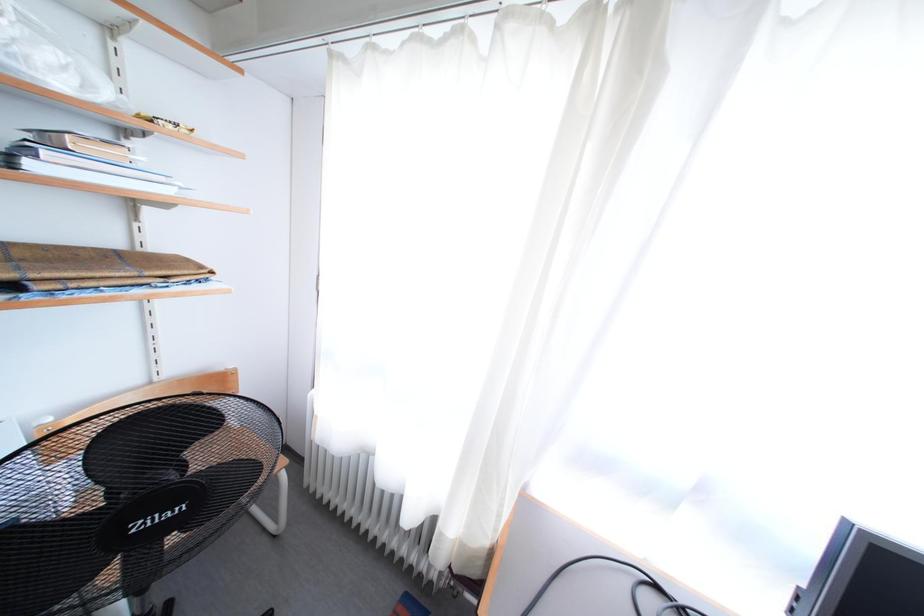
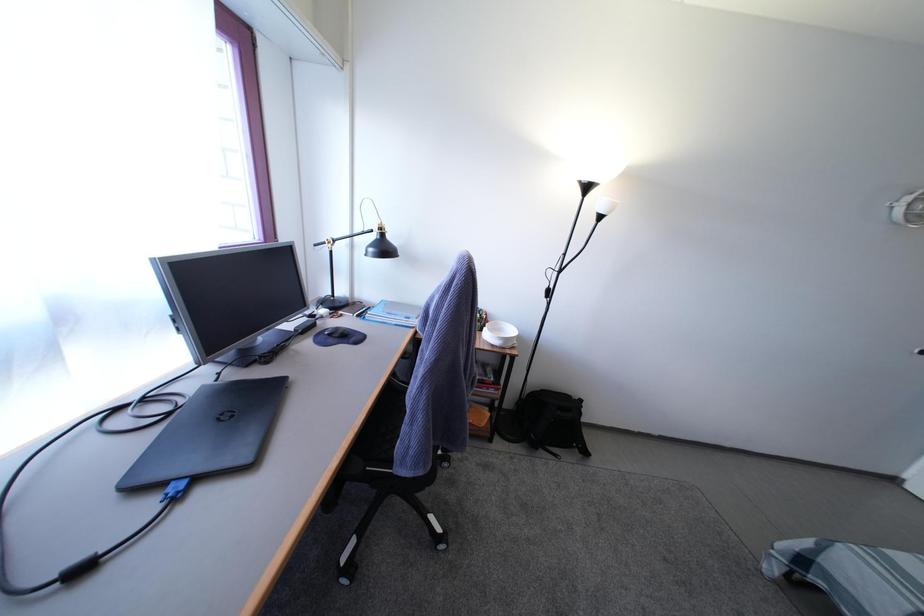
Based on the continuous images, in which direction is the camera rotating?

The rotation direction of the camera is right-down.